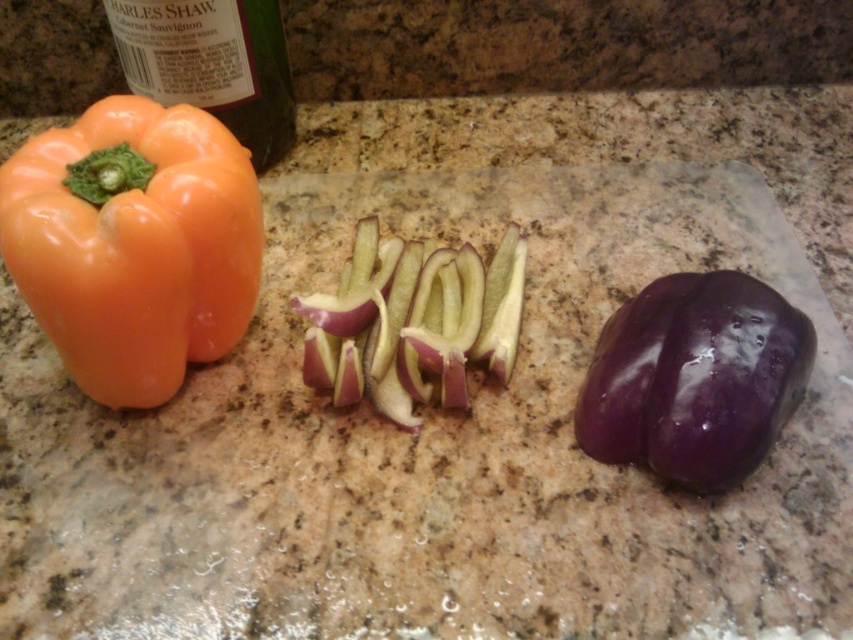
In the scene shown: Does glossy purple bell pepper at right appear under purple glossy sliced eggplant at center?

Correct, glossy purple bell pepper at right is located below purple glossy sliced eggplant at center.

Which is behind, point (729, 369) or point (399, 259)?

The point (399, 259) is more distant.

Describe the element at coordinates (695, 378) in the screenshot. I see `glossy purple bell pepper at right` at that location.

Where is `glossy purple bell pepper at right`? The image size is (853, 640). glossy purple bell pepper at right is located at coordinates (695, 378).

Between orange glossy bell pepper at left and glossy purple bell pepper at right, which one appears on the left side from the viewer's perspective?

From the viewer's perspective, orange glossy bell pepper at left appears more on the left side.

Does orange glossy bell pepper at left lie behind glossy purple bell pepper at right?

No, it is not.

The image size is (853, 640). Describe the element at coordinates (132, 243) in the screenshot. I see `orange glossy bell pepper at left` at that location.

Where is `orange glossy bell pepper at left`? orange glossy bell pepper at left is located at coordinates (132, 243).

Who is more distant from viewer, (734, 397) or (212, 58)?

The point (212, 58) is behind.

Who is more forward, (778, 426) or (247, 58)?

Point (778, 426) is more forward.

Who is more distant from viewer, (735, 470) or (218, 16)?

The point (218, 16) is behind.

This screenshot has width=853, height=640. I want to click on glossy purple bell pepper at right, so (695, 378).